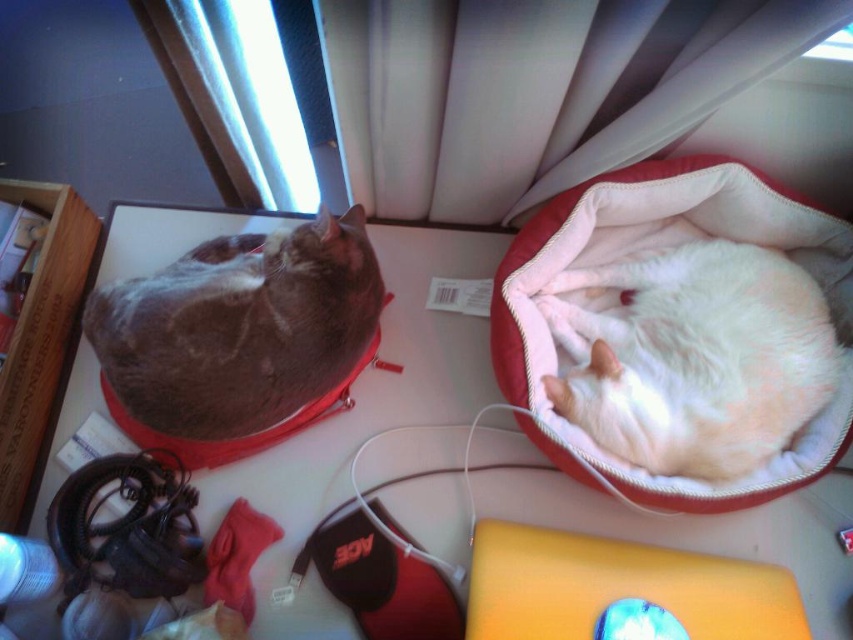
Which of these two, white glossy table at center or gray fur cat at left, stands taller?

white glossy table at center

You are a GUI agent. You are given a task and a screenshot of the screen. Output one action in this format:
    pyautogui.click(x=<x>, y=<y>)
    Task: Click on the white glossy table at center
    Image resolution: width=853 pixels, height=640 pixels.
    Given the screenshot: What is the action you would take?
    pyautogui.click(x=364, y=417)

Between white glossy table at center and white fluffy cat at center, which one has less height?

white fluffy cat at center

Is white glossy table at center to the left of white fluffy cat at center from the viewer's perspective?

Yes, white glossy table at center is to the left of white fluffy cat at center.

This screenshot has height=640, width=853. Describe the element at coordinates (364, 417) in the screenshot. I see `white glossy table at center` at that location.

Image resolution: width=853 pixels, height=640 pixels. Find the location of `white glossy table at center`. white glossy table at center is located at coordinates (364, 417).

Is point (642, 445) positioned after point (136, 356)?

No, (642, 445) is closer to viewer.

Does white fluffy cat at center appear over gray fur cat at left?

No, white fluffy cat at center is not above gray fur cat at left.

I want to click on white fluffy cat at center, so click(x=695, y=358).